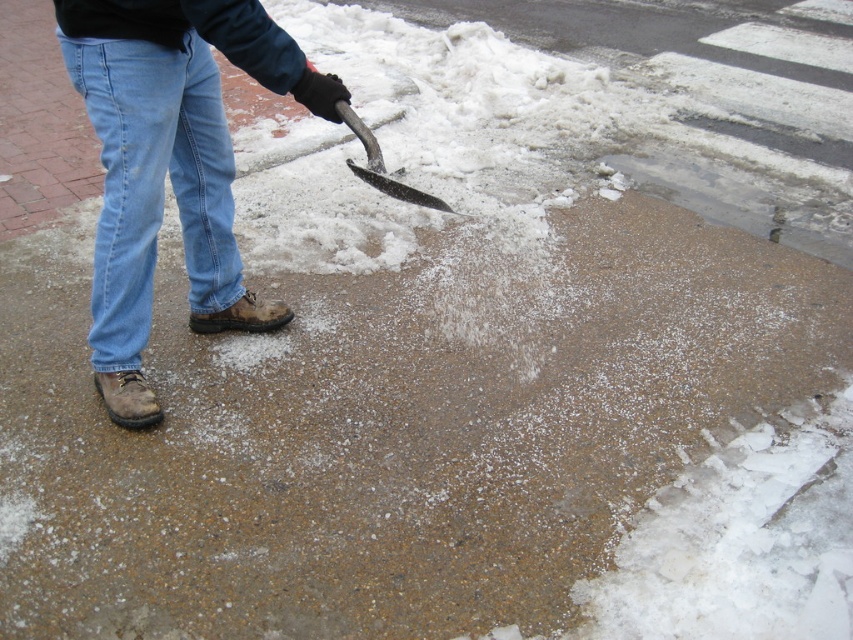
You are a pedestrian trying to walk across the sidewalk. There is a denim at left and a black metal shovel at center. Which object is closer to you as you approach the sidewalk?

The denim at left is closer to you because the black metal shovel at center is behind it.

In the scene shown: You are a photographer trying to capture the scene of a person shoveling snow. You need to ensure that both the denim at left and the black metal shovel at center are clearly visible in your photo. Given their widths, which object should you focus on to ensure they are both in frame without cropping?

The denim at left is wider than the black metal shovel at center. To ensure both are in frame without cropping, focus on the denim at left as it is wider and will require more space.

You are a photographer trying to capture the person shoveling snow. You want to ensure both the denim at left and the black metal shovel at center are clearly visible in your shot. Given their sizes, which object should you focus on first to ensure proper framing?

The denim at left has a larger size compared to the black metal shovel at center, so you should focus on the denim at left first to ensure it fits well within the frame before adjusting for the smaller shovel.